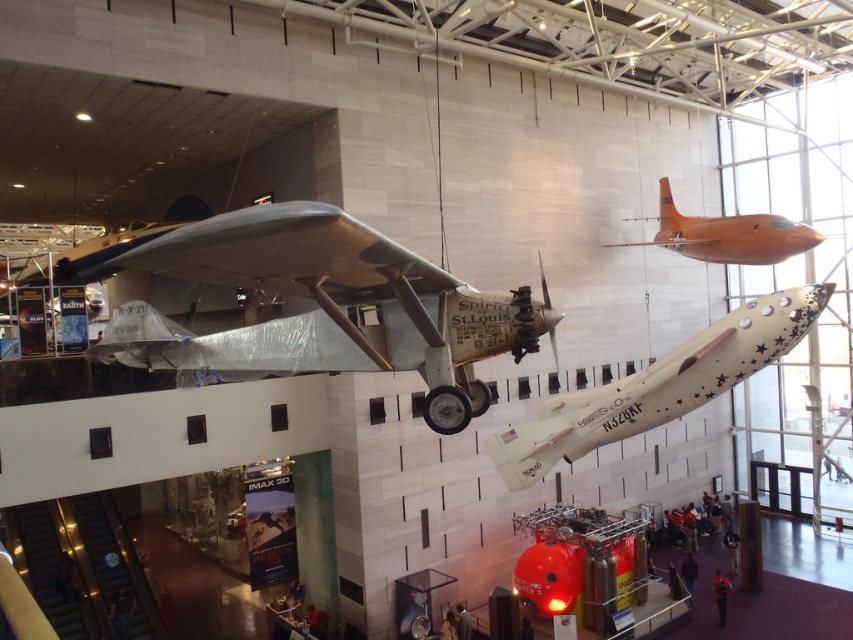
You are an architect designing a new wing for the museum. You need to determine if the white matte airplane at center can fit through a doorway that currently accommodates the orange glossy airplane at upper right. Based on their sizes, what is your assessment?

The white matte airplane at center is wider than the orange glossy airplane at upper right, so it may not fit through the doorway designed for the orange glossy airplane at upper right unless adjustments are made.

You are a museum guide who needs to move a 2.5 meter wide cart between the silver metallic airplane at center and the orange glossy airplane at upper right. Can you fit the cart through the space between them?

The distance between the silver metallic airplane at center and the orange glossy airplane at upper right is 6.69 meters, so yes, the cart can fit through the space between them since it is wider than the cart.